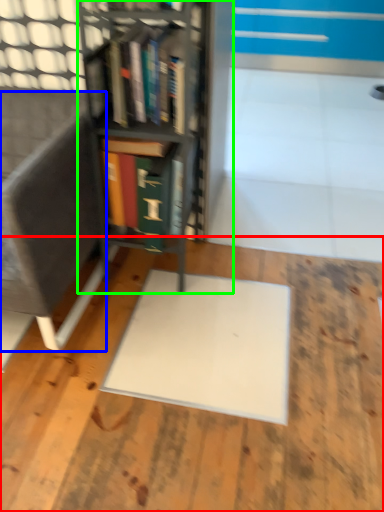
Question: Considering the real-world distances, which object is farthest from wood (highlighted by a red box)? armchair (highlighted by a blue box) or bookcase (highlighted by a green box)?

Choices:
 (A) armchair
 (B) bookcase

Answer: (B)